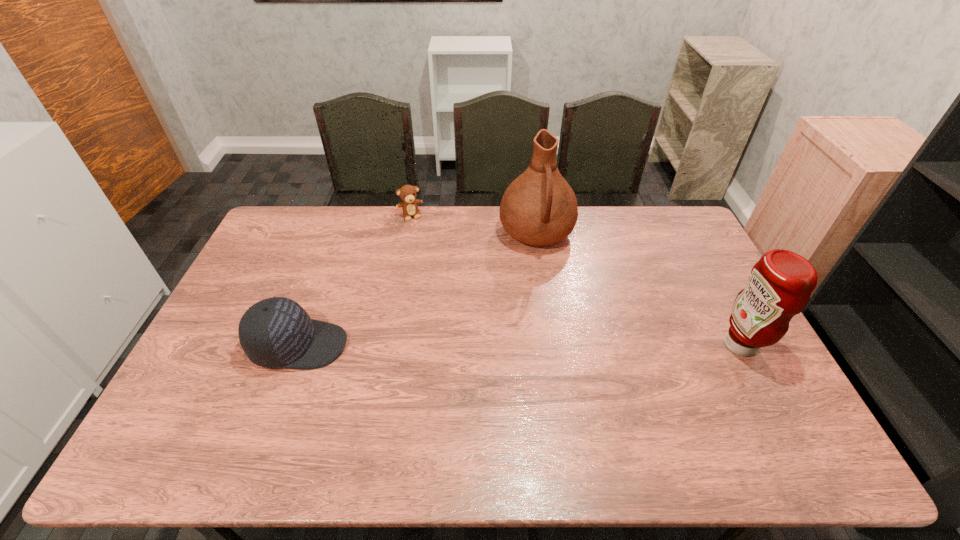
The height and width of the screenshot is (540, 960). In order to click on vacant space located on the face of the teddy bear in this screenshot , I will do `click(439, 284)`.

This screenshot has height=540, width=960. Find the location of `vacant area situated 0.220m on the face of the teddy bear`. vacant area situated 0.220m on the face of the teddy bear is located at coordinates (428, 257).

Identify the location of free spot located 0.060m on the face of the teddy bear. (417, 231).

I want to click on free space located 0.310m on the side of the pitcher with the handle, so click(x=558, y=330).

Find the location of a particular element. free space located on the side of the pitcher with the handle is located at coordinates (559, 335).

Where is `vacant space located 0.200m on the side of the pitcher with the handle`? Image resolution: width=960 pixels, height=540 pixels. vacant space located 0.200m on the side of the pitcher with the handle is located at coordinates (551, 303).

The height and width of the screenshot is (540, 960). In order to click on teddy bear positioned at the far edge in this screenshot , I will do `click(407, 193)`.

You are a GUI agent. You are given a task and a screenshot of the screen. Output one action in this format:
    pyautogui.click(x=<x>, y=<y>)
    Task: Click on the pitcher that is at the far edge
    This screenshot has width=960, height=540.
    Given the screenshot: What is the action you would take?
    pyautogui.click(x=539, y=208)

You are a GUI agent. You are given a task and a screenshot of the screen. Output one action in this format:
    pyautogui.click(x=<x>, y=<y>)
    Task: Click on the object at the left edge
    
    Given the screenshot: What is the action you would take?
    (276, 332)

Find the location of a particular element. object that is at the right edge is located at coordinates (780, 284).